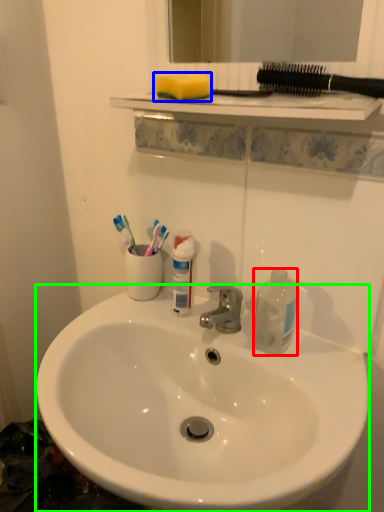
Question: Which is nearer to the bottle (highlighted by a red box)? toothpick (highlighted by a blue box) or sink (highlighted by a green box).

Choices:
 (A) toothpick
 (B) sink

Answer: (B)